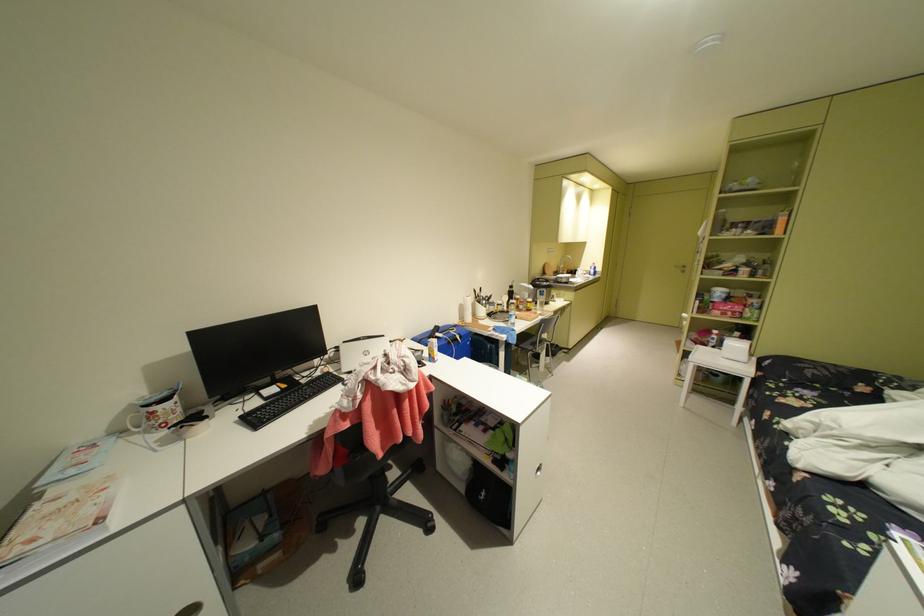
What are the coordinates of `silver door handle` in the screenshot? It's located at (538, 469).